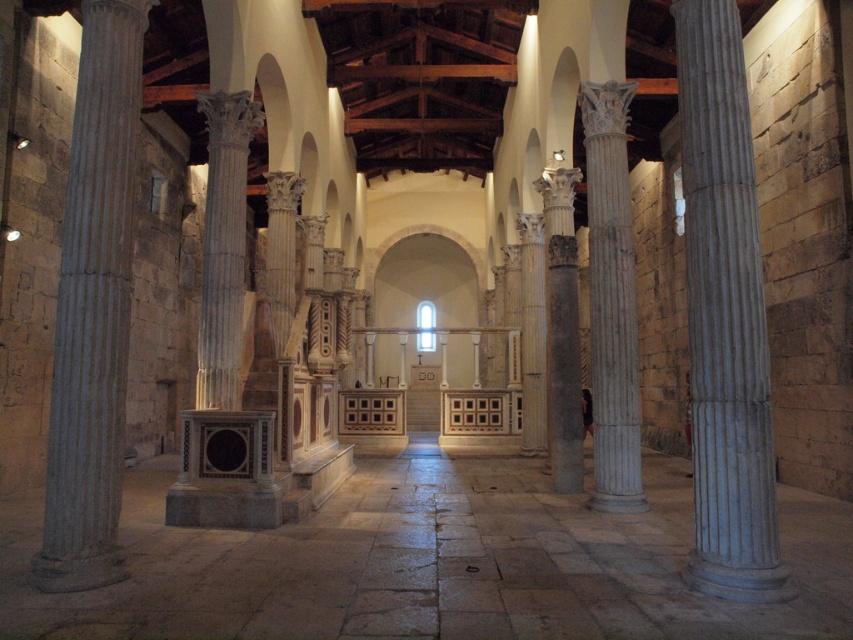
Question: Which object is positioned farthest from the white marble column at center?

Choices:
 (A) white marble column at left
 (B) gray marble column at right

Answer: (A)

Question: Is white marble floor at center positioned in front of white marble column at center?

Choices:
 (A) no
 (B) yes

Answer: (B)

Question: Which point is closer to the camera?

Choices:
 (A) (51, 378)
 (B) (555, 273)
 (C) (718, 72)

Answer: (C)

Question: Observing the image, what is the correct spatial positioning of white marble floor at center in reference to gray marble column at right?

Choices:
 (A) below
 (B) above

Answer: (A)

Question: Observing the image, what is the correct spatial positioning of white marble floor at center in reference to white marble column at center?

Choices:
 (A) left
 (B) right

Answer: (A)

Question: Which of these objects is positioned closest to the gray marble column at center?

Choices:
 (A) white marble floor at center
 (B) gray marble column at right
 (C) white marble column at center
 (D) white marble column at left

Answer: (C)